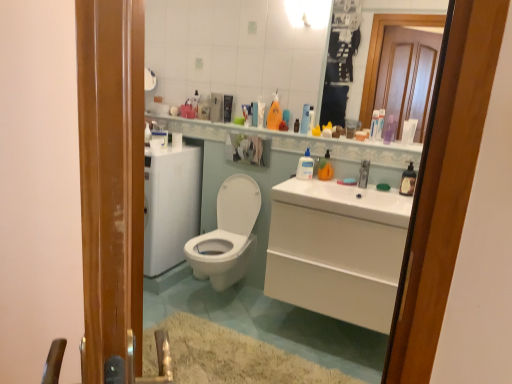
Where is `free space in front of white glossy toilet at center`? The height and width of the screenshot is (384, 512). free space in front of white glossy toilet at center is located at coordinates (218, 336).